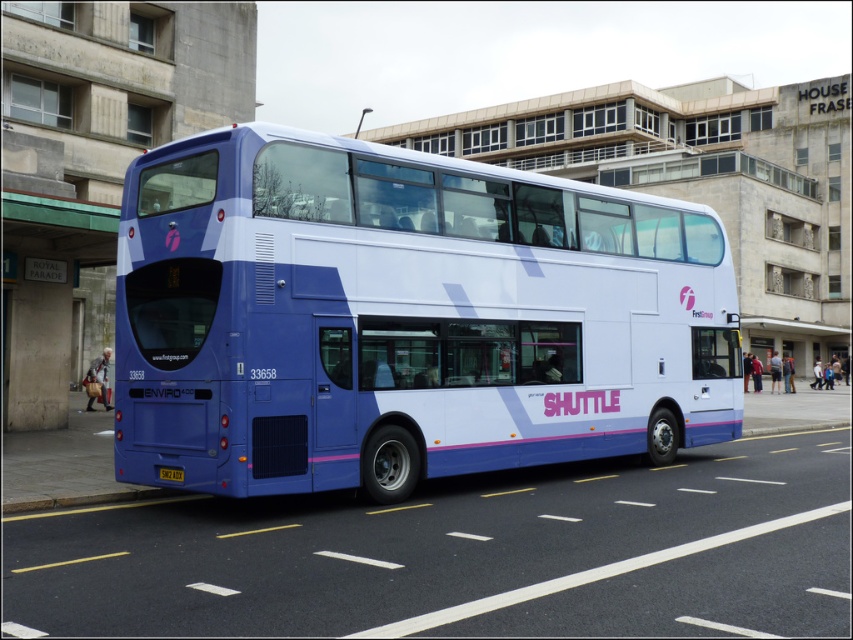
Question: Which point is farther from the camera taking this photo?

Choices:
 (A) (25, 392)
 (B) (164, 474)
 (C) (306, 193)

Answer: (A)

Question: Does green concrete bus stop at lower left appear on the right side of yellow metallic license plate at rear center?

Choices:
 (A) yes
 (B) no

Answer: (B)

Question: Estimate the real-world distances between objects in this image. Which object is farther from the yellow metallic license plate at rear center?

Choices:
 (A) green concrete bus stop at lower left
 (B) blue metallic/decorative bus at center

Answer: (A)

Question: Can you confirm if green concrete bus stop at lower left is bigger than yellow metallic license plate at rear center?

Choices:
 (A) yes
 (B) no

Answer: (A)

Question: Can you confirm if blue metallic/decorative bus at center is positioned to the left of green concrete bus stop at lower left?

Choices:
 (A) yes
 (B) no

Answer: (B)

Question: Which point is farther to the camera?

Choices:
 (A) green concrete bus stop at lower left
 (B) yellow metallic license plate at rear center
 (C) blue metallic/decorative bus at center

Answer: (A)